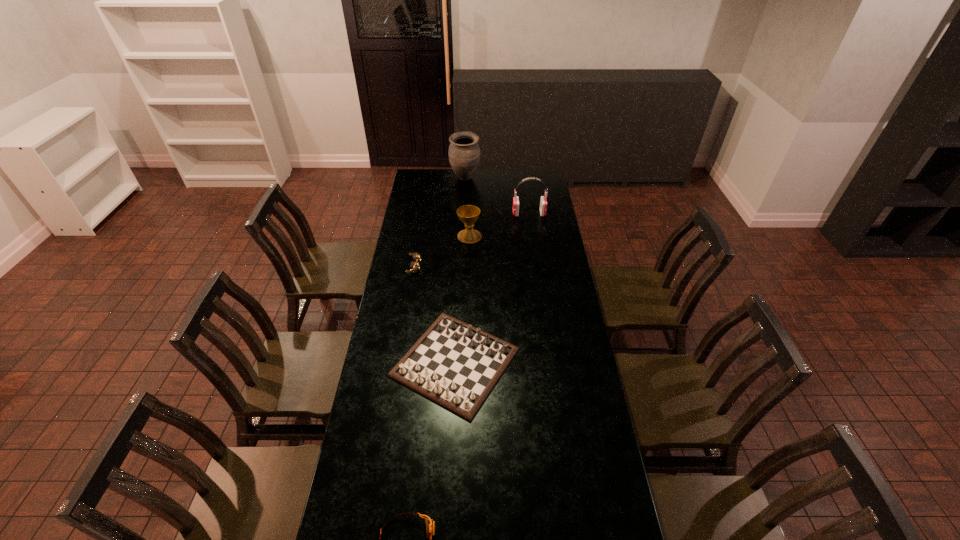
Select which object is the third closest to the third tallest object. Please provide its 2D coordinates. Your answer should be formatted as a tuple, i.e. [(x, y)], where the tuple contains the x and y coordinates of a point satisfying the conditions above.

[(464, 152)]

Locate an element on the screen. Image resolution: width=960 pixels, height=540 pixels. object that ranks as the fifth closest to the third tallest object is located at coordinates (430, 524).

The width and height of the screenshot is (960, 540). Find the location of `free space that satisfies the following two spatial constraints: 1. on the outer surface of the rightmost object; 2. on the front side of the second nearest object`. free space that satisfies the following two spatial constraints: 1. on the outer surface of the rightmost object; 2. on the front side of the second nearest object is located at coordinates (550, 362).